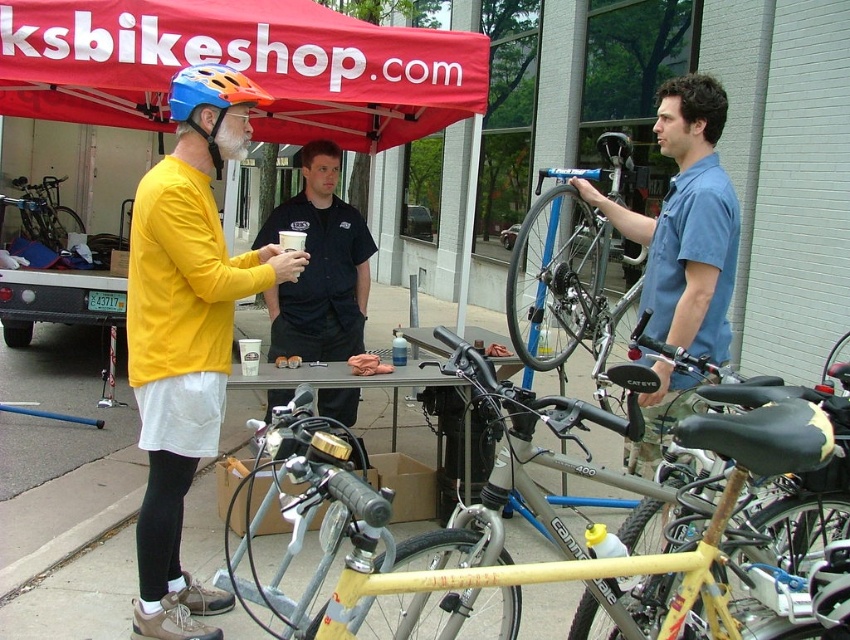
Is matte blue bicycle helmet at upper left wider than matte black bicycle at left?

→ In fact, matte blue bicycle helmet at upper left might be narrower than matte black bicycle at left.

The width and height of the screenshot is (850, 640). What do you see at coordinates (211, 99) in the screenshot?
I see `matte blue bicycle helmet at upper left` at bounding box center [211, 99].

What are the coordinates of `matte blue bicycle helmet at upper left` in the screenshot? It's located at (211, 99).

Who is more forward, (x=472, y=516) or (x=604, y=294)?

Positioned in front is point (x=472, y=516).

Which is above, matte black bike at center or blue metallic frame at center?

Positioned higher is blue metallic frame at center.

Which is in front, point (561, 548) or point (564, 205)?

Point (561, 548) is in front.

The width and height of the screenshot is (850, 640). I want to click on matte black bike at center, so click(x=596, y=540).

Does point (75, 97) come behind point (684, 408)?

Yes, it is behind point (684, 408).

Who is taller, red fabric canopy at upper center or blue cotton shirt at center?

blue cotton shirt at center

Is point (388, 109) positioned in front of point (680, 208)?

No, (388, 109) is further to viewer.

You are a GUI agent. You are given a task and a screenshot of the screen. Output one action in this format:
    pyautogui.click(x=<x>, y=<y>)
    Task: Click on the red fabric canopy at upper center
    
    Given the screenshot: What is the action you would take?
    pyautogui.click(x=239, y=67)